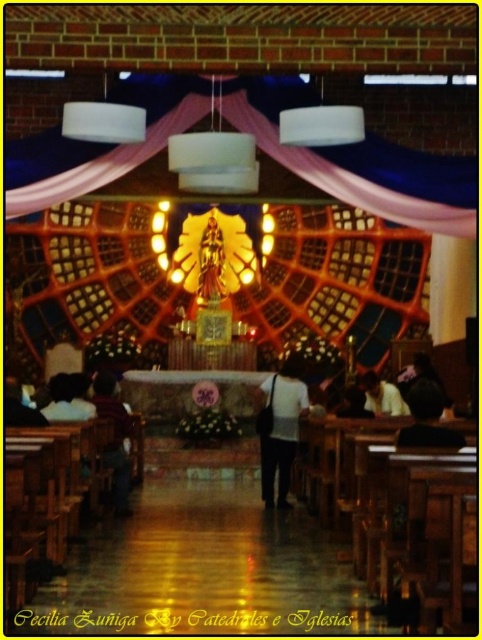
You are standing in the church and want to place a new candle holder between the dark brown leather jacket at lower left and the dark brown hair at lower right. Based on their positions, which object should the candle holder be closer to?

The candle holder should be placed closer to the dark brown hair at lower right because the dark brown leather jacket at lower left is to the left of dark brown hair at lower right, meaning the hair is on the right side and the jacket is on the left side. Therefore, the candle holder should be positioned between them but closer to the right side where the hair is located.

You are a photographer standing in front of the altar in the church. You notice the white matte shirt at center and the dark brown hair at lower right. Which object would appear larger in your camera viewfinder?

The white matte shirt at center appears larger in the camera viewfinder because it is bigger than the dark brown hair at lower right.